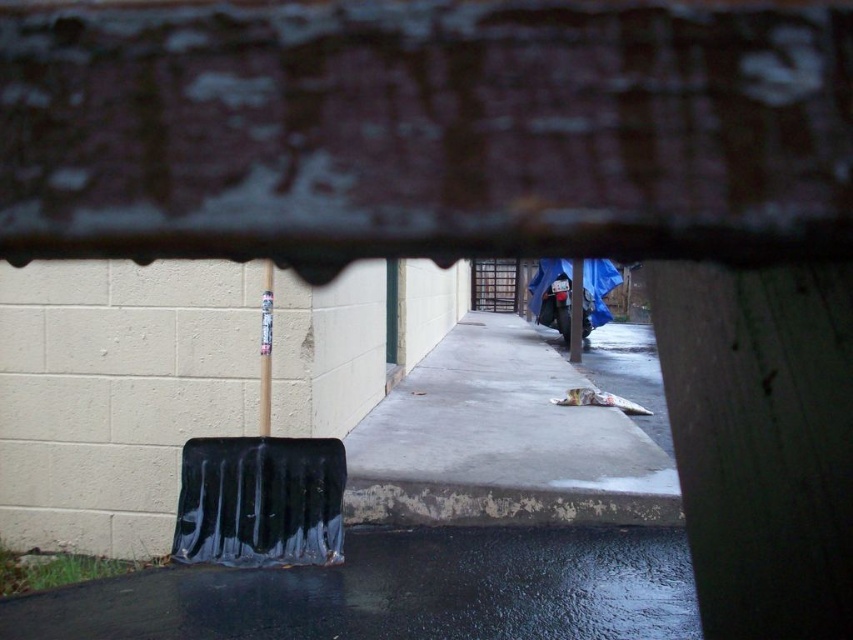
Question: Considering the relative positions of black rubber shovel at lower left and black rubber shovel at left in the image provided, where is black rubber shovel at lower left located with respect to black rubber shovel at left?

Choices:
 (A) right
 (B) left

Answer: (A)

Question: Which of the following is the closest to the observer?

Choices:
 (A) metallic silver pole at center
 (B) black rubber shovel at lower left
 (C) smooth white pole at center
 (D) smooth concrete sidewalk at center

Answer: (B)

Question: Is smooth white pole at center below metallic silver pole at center?

Choices:
 (A) yes
 (B) no

Answer: (A)

Question: Is black rubber shovel at lower left bigger than smooth concrete sidewalk at center?

Choices:
 (A) yes
 (B) no

Answer: (B)

Question: Which point is farther to the camera?

Choices:
 (A) (637, 442)
 (B) (341, 531)

Answer: (A)

Question: Which of these objects is positioned farthest from the black rubber shovel at left?

Choices:
 (A) smooth white pole at center
 (B) black rubber shovel at lower left
 (C) metallic silver pole at center
 (D) smooth concrete sidewalk at center

Answer: (C)